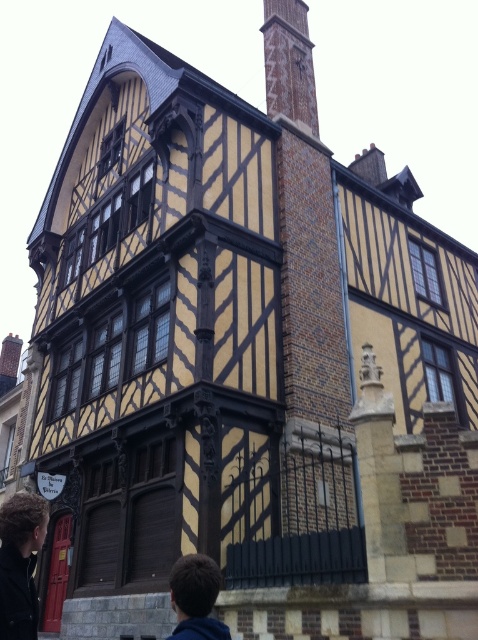
You are an architect analyzing the traditional half timbered building. You notice the brick chimney at upper center and the dark brown hair at lower left. Which object is taller in the image?

The brick chimney at upper center is much taller than the dark brown hair at lower left.

You are standing in front of a traditional half timbered building. You see a brick chimney at upper center and a brown hair at lower center. Which object is located to the right side of the other?

The brick chimney at upper center is located to the right of brown hair at lower center.

You are an architect examining this traditional building. You notice the brick chimney at upper center and the dark brown hair at lower left. Based on the building layout, which object is positioned to the right side of the other?

The brick chimney at upper center is positioned to the right of the dark brown hair at lower left.